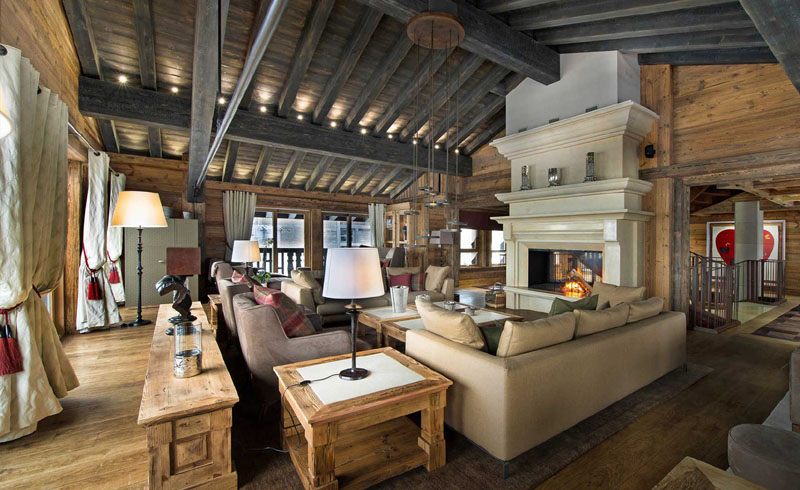
You are a GUI agent. You are given a task and a screenshot of the screen. Output one action in this format:
    pyautogui.click(x=<x>, y=<y>)
    Task: Click on the fireplace
    This screenshot has height=490, width=800.
    Given the screenshot: What is the action you would take?
    pyautogui.click(x=570, y=184)